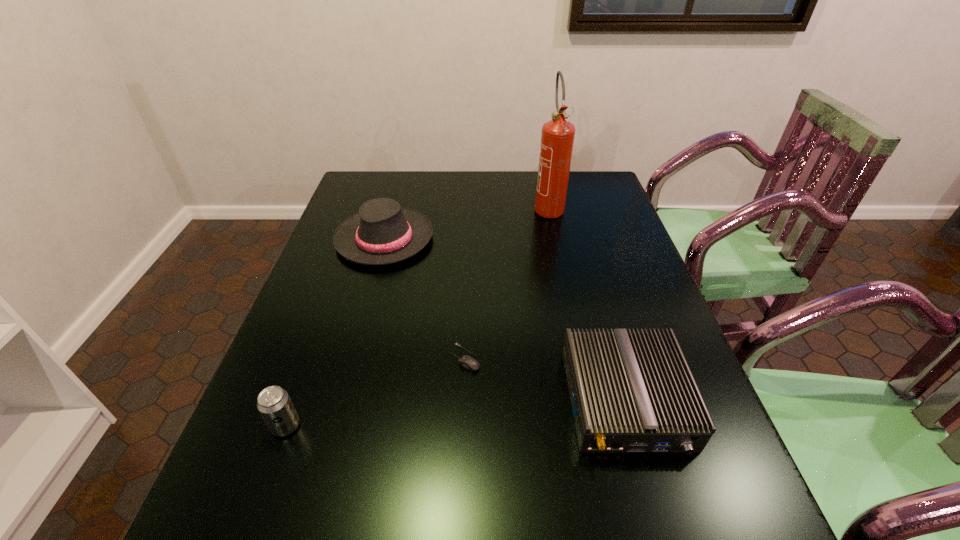
Where is `empty location between the beer can and the dress hat`? The image size is (960, 540). empty location between the beer can and the dress hat is located at coordinates (335, 332).

Find the location of a particular element. This screenshot has height=540, width=960. free space between the dress hat and the router is located at coordinates (505, 320).

You are a GUI agent. You are given a task and a screenshot of the screen. Output one action in this format:
    pyautogui.click(x=<x>, y=<y>)
    Task: Click on the vacant area that lies between the dress hat and the tallest object
    This screenshot has width=960, height=540.
    Given the screenshot: What is the action you would take?
    pyautogui.click(x=467, y=223)

Where is `unoccupied position between the beer can and the dress hat`? Image resolution: width=960 pixels, height=540 pixels. unoccupied position between the beer can and the dress hat is located at coordinates (335, 332).

At what (x,y) coordinates should I click in order to perform the action: click on vacant point located between the beer can and the third object from left to right. Please return your answer as a coordinate pair (x, y). The width and height of the screenshot is (960, 540). Looking at the image, I should click on (375, 392).

Locate an element on the screen. empty location between the dress hat and the mouse is located at coordinates (424, 298).

The height and width of the screenshot is (540, 960). I want to click on free space between the dress hat and the beer can, so click(x=335, y=332).

I want to click on vacant space that's between the shortest object and the beer can, so click(x=375, y=392).

What are the coordinates of `vacant space in between the dress hat and the beer can` in the screenshot? It's located at (335, 332).

Identify the location of object that is the third closest to the mouse. The width and height of the screenshot is (960, 540). (274, 404).